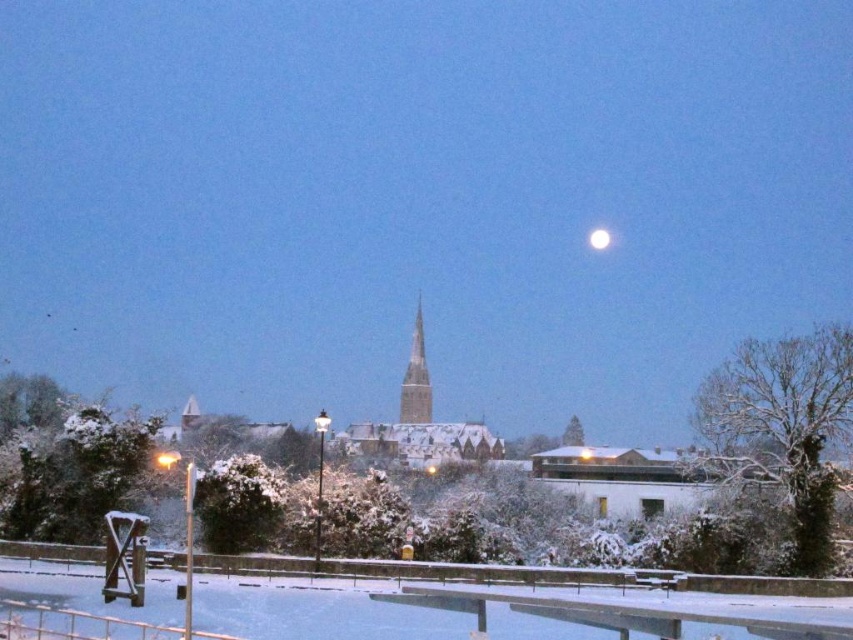
Question: Is white snow-covered church steeple at center wider than white glossy moon at upper center?

Choices:
 (A) yes
 (B) no

Answer: (A)

Question: Which point is farther to the camera?

Choices:
 (A) white glossy moon at upper center
 (B) smooth stone spire at center

Answer: (A)

Question: Which object appears farthest from the camera in this image?

Choices:
 (A) white glossy moon at upper center
 (B) white snow-covered church steeple at center
 (C) smooth stone spire at center

Answer: (A)

Question: Among these points, which one is nearest to the camera?

Choices:
 (A) (422, 356)
 (B) (592, 232)

Answer: (A)

Question: Is white snow-covered church steeple at center positioned before white glossy moon at upper center?

Choices:
 (A) yes
 (B) no

Answer: (A)

Question: Is white snow-covered church steeple at center smaller than white glossy moon at upper center?

Choices:
 (A) no
 (B) yes

Answer: (A)